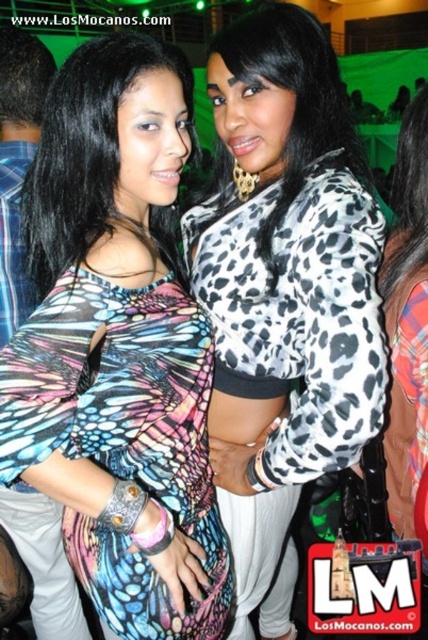
Does multicolored printed dress at center lie in front of leopard print jacket at center?

Yes, it is in front of leopard print jacket at center.

Is multicolored printed dress at center wider than leopard print jacket at center?

Indeed, multicolored printed dress at center has a greater width compared to leopard print jacket at center.

This screenshot has height=640, width=428. In order to click on multicolored printed dress at center in this screenshot , I will do `click(118, 348)`.